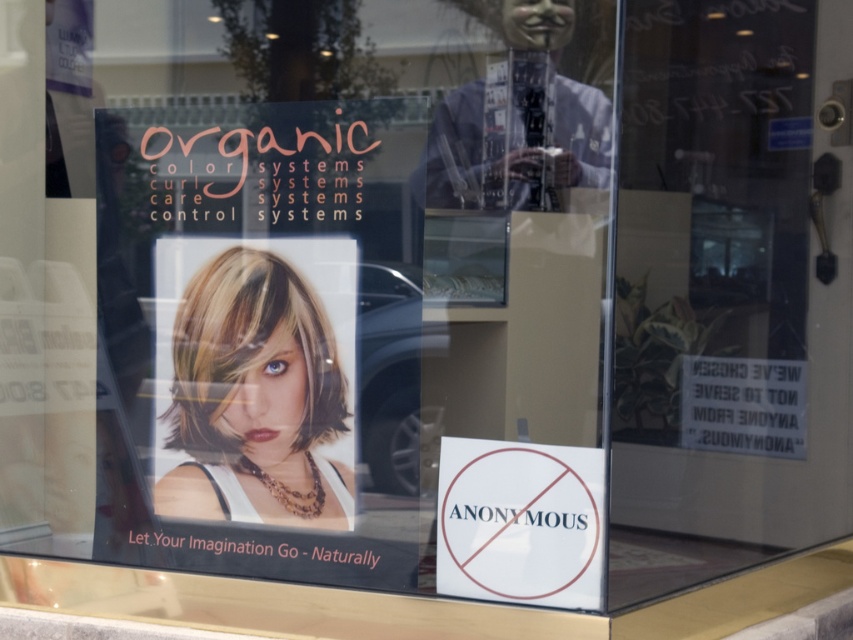
You are a customer looking at the storefront window display. You see the blonde hair at center and the white paper sign at lower center. Which object is positioned to the left?

The blonde hair at center is positioned to the left of the white paper sign at lower center.

You are a customer standing outside the store window. You want to touch the blonde hair at center and the white paper sign at lower center. Which one is closer to you?

The blonde hair at center is 26.83 inches away from the white paper sign at lower center, so the white paper sign at lower center is closer to you.

You are a customer looking at the storefront window display. You notice the blonde hair at center and the white paper sign at lower center. Which object takes up more space in the display?

The blonde hair at center has a larger size compared to the white paper sign at lower center, so it takes up more space in the display.